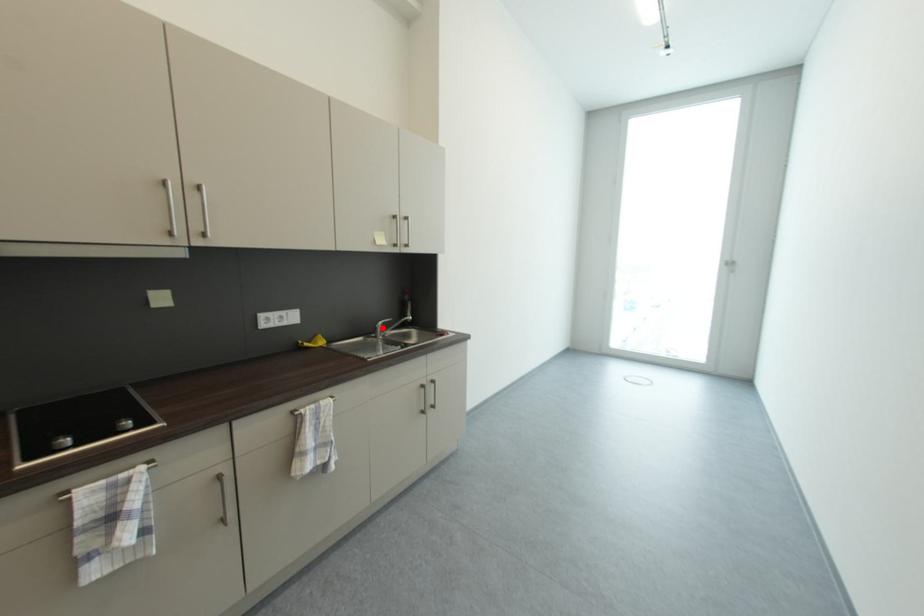
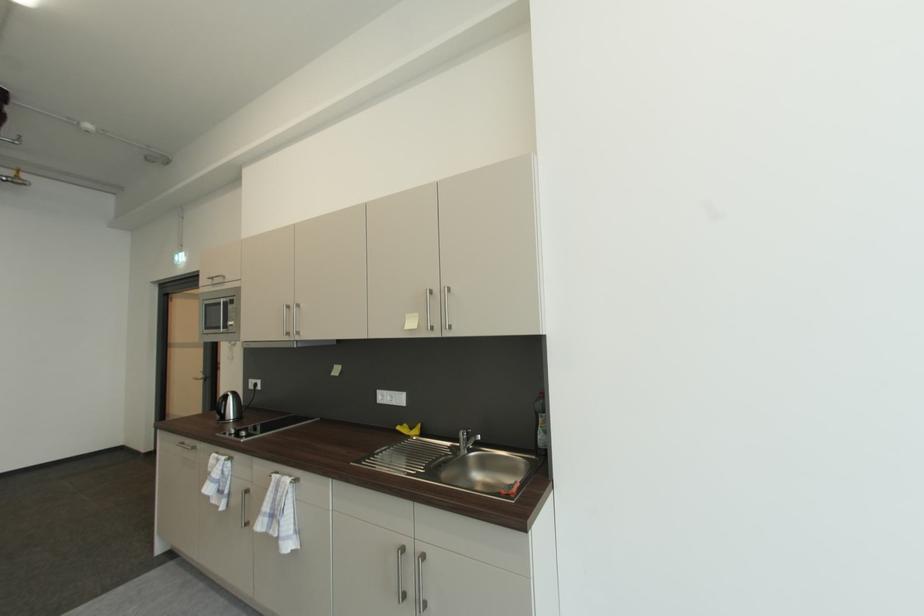
Find the pixel in the second image that matches the highlighted location in the first image.

(465, 435)